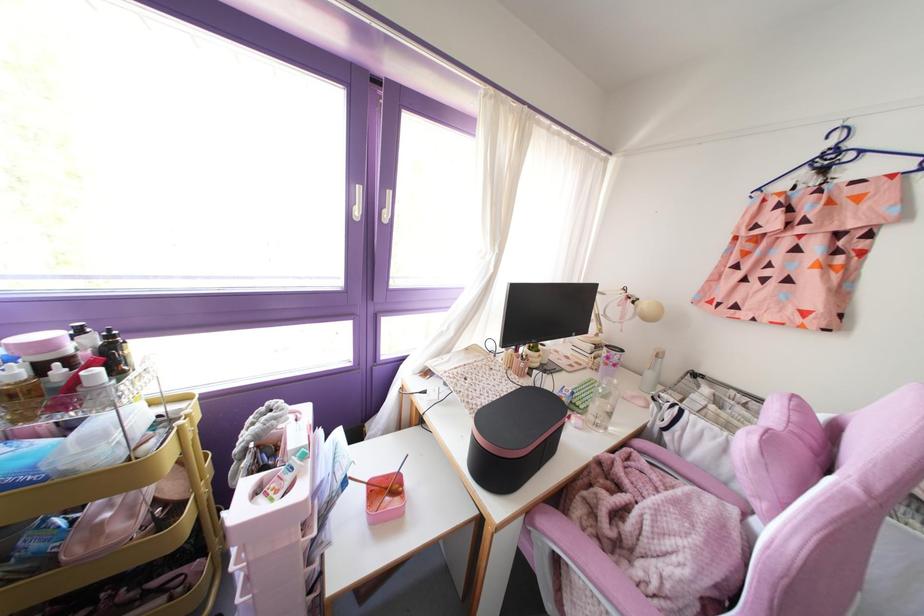
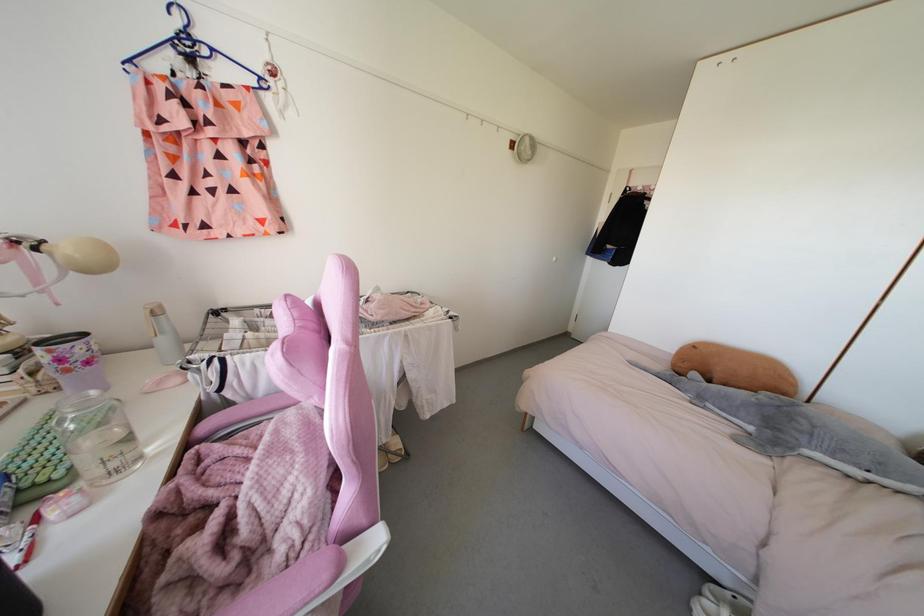
Find the pixel in the second image that matches pixel 639 443 in the first image.

(204, 426)